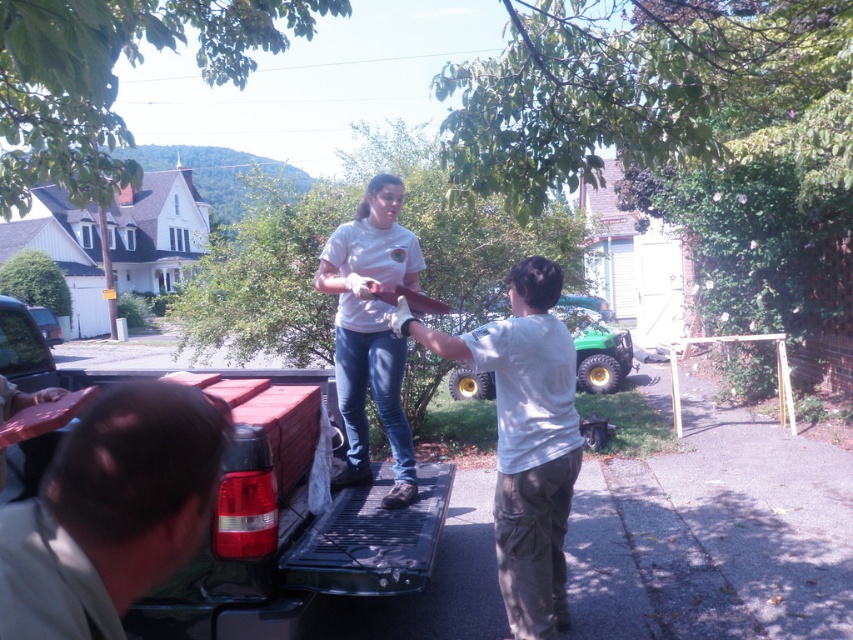
Question: Where is white cotton shirt at center located in relation to white matte shirt at center in the image?

Choices:
 (A) left
 (B) right

Answer: (B)

Question: Based on their relative distances, which object is farther from the white cotton shirt at center?

Choices:
 (A) white matte shirt at center
 (B) light brown leather jacket at lower left

Answer: (B)

Question: Which point appears closest to the camera in this image?

Choices:
 (A) (328, 256)
 (B) (97, 436)

Answer: (B)

Question: Can you confirm if light brown leather jacket at lower left is positioned to the left of white matte shirt at center?

Choices:
 (A) no
 (B) yes

Answer: (B)

Question: Among these objects, which one is farthest from the camera?

Choices:
 (A) light brown leather jacket at lower left
 (B) white matte shirt at center

Answer: (B)

Question: Does light brown leather jacket at lower left have a greater width compared to white cotton shirt at center?

Choices:
 (A) yes
 (B) no

Answer: (B)